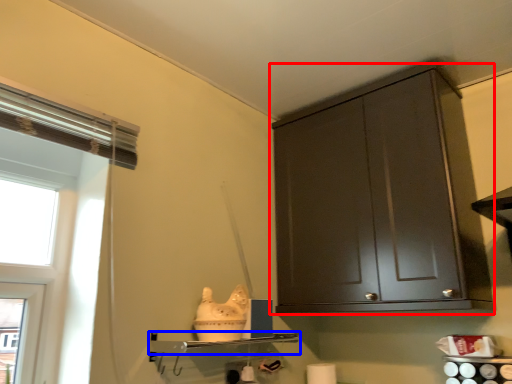
Question: Which object appears farthest to the camera in this image, cabinetry (highlighted by a red box) or shelf (highlighted by a blue box)?

Choices:
 (A) cabinetry
 (B) shelf

Answer: (A)